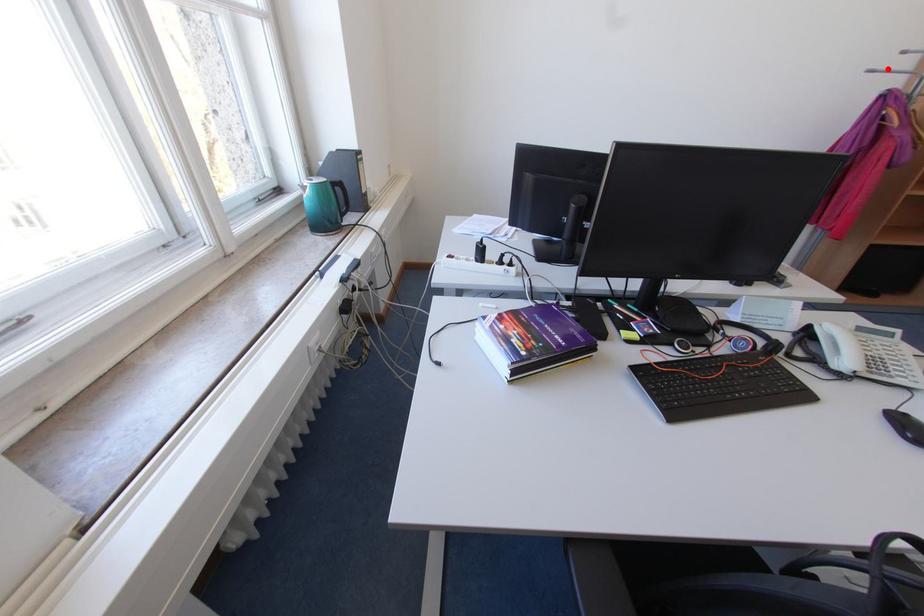
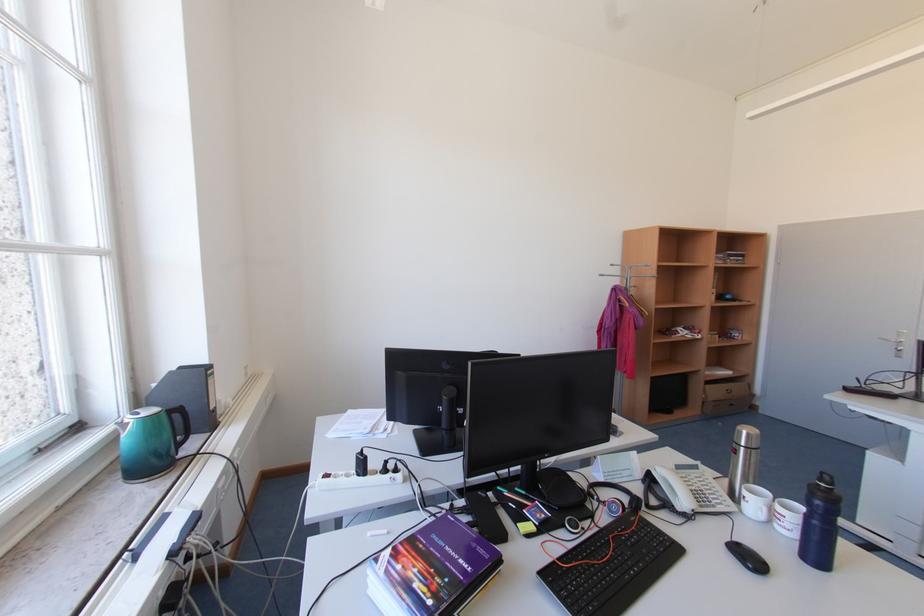
The point at the highlighted location is marked in the first image. Where is the corresponding point in the second image?

(613, 275)